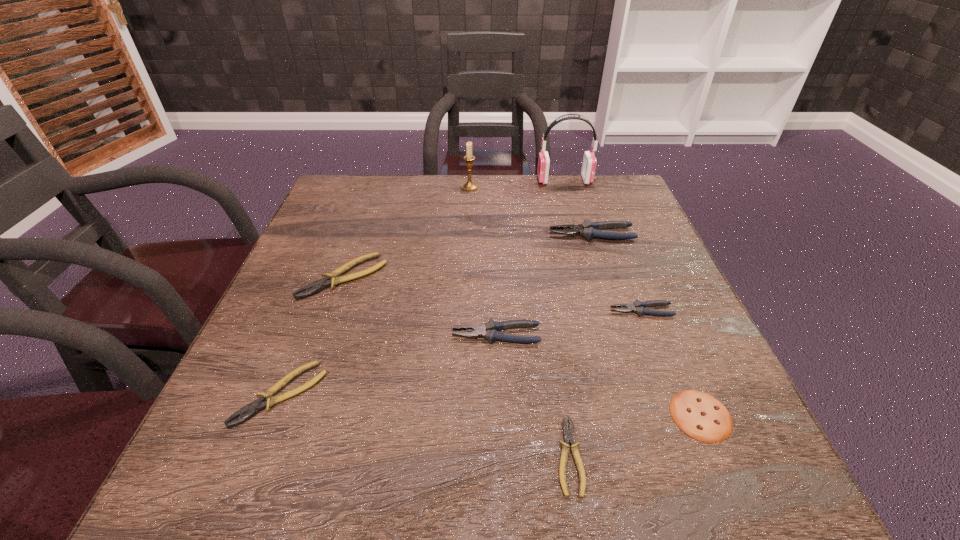
The height and width of the screenshot is (540, 960). Identify the location of the smallest gray pliers. (638, 307).

Find the location of a particular element. The height and width of the screenshot is (540, 960). the fifth tallest pliers is located at coordinates (248, 411).

I want to click on cookie, so click(701, 416).

What are the coordinates of `the shortest pliers` in the screenshot? It's located at (568, 435).

This screenshot has height=540, width=960. Identify the location of the smallest yellow pliers. (568, 435).

You are a GUI agent. You are given a task and a screenshot of the screen. Output one action in this format:
    pyautogui.click(x=<x>, y=<y>)
    Task: Click on the vacant area situated on the outer surface of the tallest object
    This screenshot has height=540, width=960.
    Given the screenshot: What is the action you would take?
    pyautogui.click(x=440, y=180)

Where is `vacant space positioned 0.190m on the outer surface of the tallest object`? Image resolution: width=960 pixels, height=540 pixels. vacant space positioned 0.190m on the outer surface of the tallest object is located at coordinates (473, 180).

I want to click on free space located on the outer surface of the tallest object, so (x=517, y=180).

Locate an element on the screen. vacant point located on the front of the candle holder is located at coordinates (468, 230).

Identify the location of free space located at the gripping part of the farthest gray pliers. Image resolution: width=960 pixels, height=540 pixels. (425, 234).